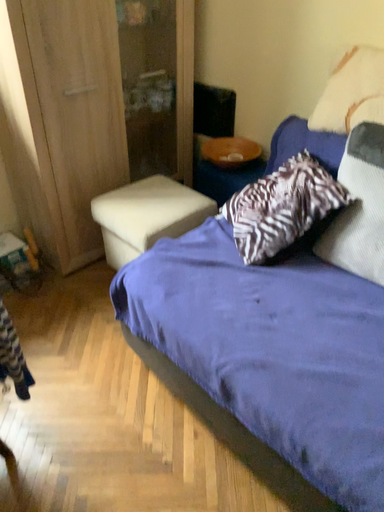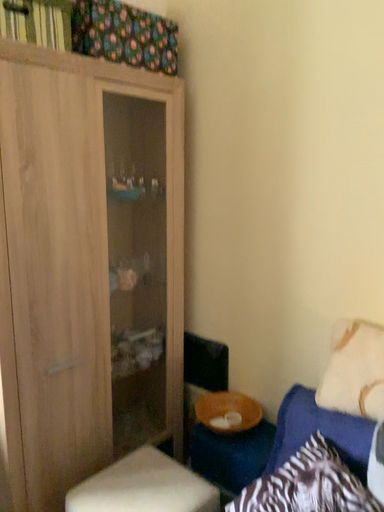
Question: Which way did the camera rotate in the video?

Choices:
 (A) rotated upward
 (B) rotated downward

Answer: (A)